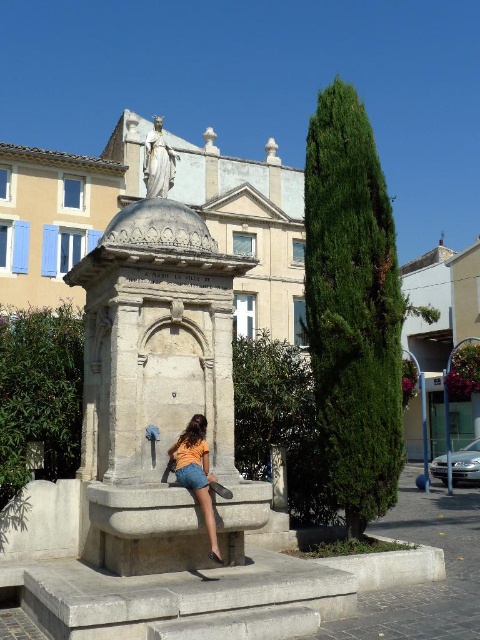
Describe the element at coordinates (197, 474) in the screenshot. This screenshot has width=480, height=640. I see `orange cotton shirt at center` at that location.

The image size is (480, 640). What are the coordinates of `orange cotton shirt at center` in the screenshot? It's located at (197, 474).

Who is more forward, (213, 524) or (160, 196)?

Point (213, 524)

Where is `orange cotton shirt at center`? This screenshot has height=640, width=480. orange cotton shirt at center is located at coordinates (197, 474).